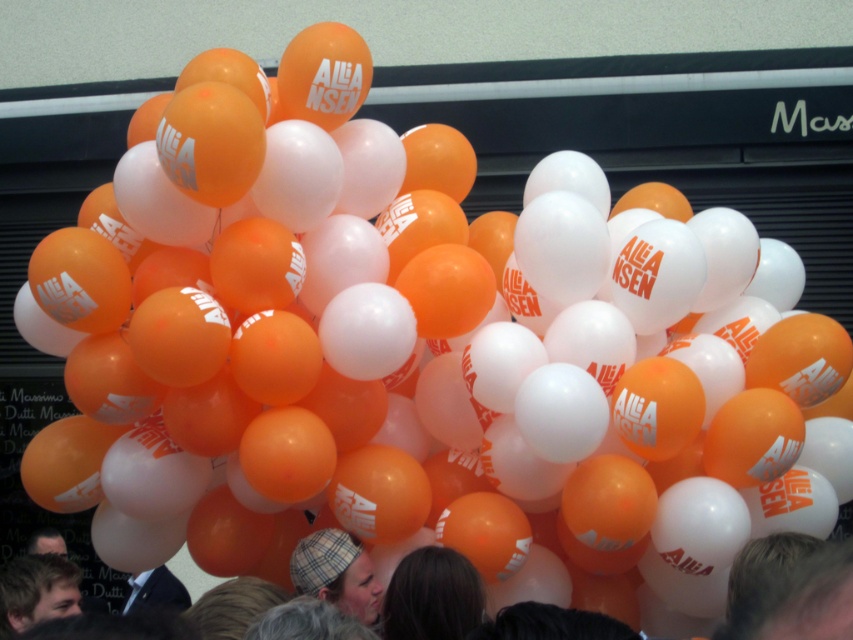
Can you confirm if orange matte balloons at center is bigger than plaid fabric hat at center?

Indeed, orange matte balloons at center has a larger size compared to plaid fabric hat at center.

Who is positioned more to the left, orange matte balloons at center or plaid fabric hat at center?

From the viewer's perspective, plaid fabric hat at center appears more on the left side.

Does point (817, 616) lie behind point (372, 611)?

No, (817, 616) is closer to viewer.

This screenshot has height=640, width=853. In order to click on orange matte balloons at center in this screenshot , I will do `click(799, 600)`.

Between light brown hair at lower left and dark hair at center, which one has more height?

light brown hair at lower left

Between point (56, 563) and point (38, 541), which one is positioned behind?

Positioned behind is point (38, 541).

Is point (49, 614) behind point (44, 534)?

No, it is not.

You are a GUI agent. You are given a task and a screenshot of the screen. Output one action in this format:
    pyautogui.click(x=<x>, y=<y>)
    Task: Click on the light brown hair at lower left
    
    Given the screenshot: What is the action you would take?
    [x=36, y=592]

Can you confirm if orange matte balloons at center is thinner than dark brown hair at lower center?

Incorrect, orange matte balloons at center's width is not less than dark brown hair at lower center's.

Does orange matte balloons at center appear on the right side of dark brown hair at lower center?

Indeed, orange matte balloons at center is positioned on the right side of dark brown hair at lower center.

Is point (291, 605) positioned in front of point (463, 621)?

Yes, it is in front of point (463, 621).

At what (x,y) coordinates should I click in order to perform the action: click on orange matte balloons at center. Please return your answer as a coordinate pair (x, y). Looking at the image, I should click on (799, 600).